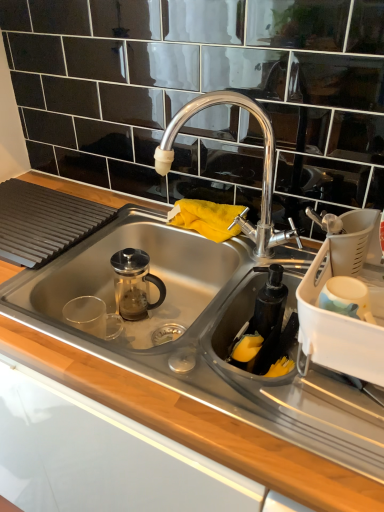
Question: Is stainless steel sink at center smaller than white plastic dish rack at right, which is the first appliance in right-to-left order?

Choices:
 (A) yes
 (B) no

Answer: (B)

Question: Considering the relative sizes of stainless steel sink at center and white plastic dish rack at right, which is the first appliance in right-to-left order, in the image provided, is stainless steel sink at center wider than white plastic dish rack at right, which is the first appliance in right-to-left order,?

Choices:
 (A) no
 (B) yes

Answer: (B)

Question: Can you confirm if stainless steel sink at center is thinner than white plastic dish rack at right, the second appliance from the left?

Choices:
 (A) yes
 (B) no

Answer: (B)

Question: From a real-world perspective, is stainless steel sink at center on top of white plastic dish rack at right, the second appliance from the left?

Choices:
 (A) yes
 (B) no

Answer: (B)

Question: Does stainless steel sink at center turn towards white plastic dish rack at right, which is the first appliance in right-to-left order?

Choices:
 (A) no
 (B) yes

Answer: (A)

Question: Does point (182, 327) appear closer or farther from the camera than point (271, 139)?

Choices:
 (A) farther
 (B) closer

Answer: (A)

Question: From the image's perspective, relative to polished chrome faucet at center, is stainless steel sink at center above or below?

Choices:
 (A) above
 (B) below

Answer: (B)

Question: Relative to polished chrome faucet at center, is stainless steel sink at center in front or behind?

Choices:
 (A) behind
 (B) front

Answer: (B)

Question: In terms of width, does stainless steel sink at center look wider or thinner when compared to polished chrome faucet at center?

Choices:
 (A) wide
 (B) thin

Answer: (A)

Question: Based on their sizes in the image, would you say white plastic dish rack at right, which is the first appliance in right-to-left order, is bigger or smaller than black matte soap dispenser at lower right, the 1th appliance viewed from the left?

Choices:
 (A) small
 (B) big

Answer: (B)

Question: From a real-world perspective, is white plastic dish rack at right, the second appliance from the left, positioned above or below black matte soap dispenser at lower right, the 1th appliance viewed from the left?

Choices:
 (A) below
 (B) above

Answer: (B)

Question: Relative to black matte soap dispenser at lower right, the 1th appliance viewed from the left, is white plastic dish rack at right, the second appliance from the left, in front or behind?

Choices:
 (A) front
 (B) behind

Answer: (A)

Question: In terms of height, does white plastic dish rack at right, the second appliance from the left, look taller or shorter compared to black matte soap dispenser at lower right, the 1th appliance viewed from the left?

Choices:
 (A) tall
 (B) short

Answer: (A)

Question: Looking at the image, does white plastic dish rack at right, which is the first appliance in right-to-left order, seem bigger or smaller compared to stainless steel sink at center?

Choices:
 (A) small
 (B) big

Answer: (A)

Question: In the image, is white plastic dish rack at right, the second appliance from the left, on the left side or the right side of stainless steel sink at center?

Choices:
 (A) left
 (B) right

Answer: (B)